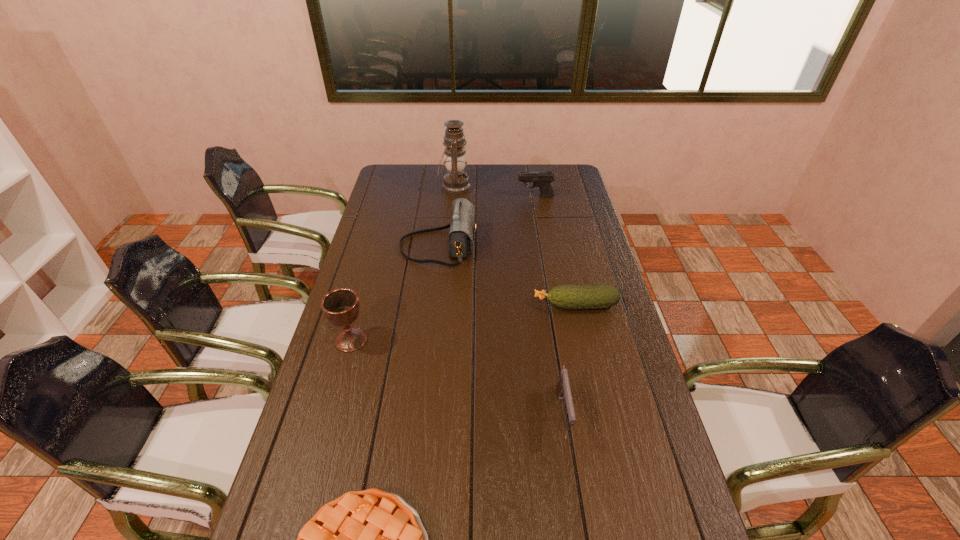
Where is `vacant space situated at the barrel of the farther pistol`? The height and width of the screenshot is (540, 960). vacant space situated at the barrel of the farther pistol is located at coordinates (479, 197).

In order to click on free spot located at the barrel of the farther pistol in this screenshot , I will do `click(477, 197)`.

Locate an element on the screen. The width and height of the screenshot is (960, 540). vacant space situated at the barrel of the farther pistol is located at coordinates (486, 197).

Where is `vacant point located 0.090m at the barrel of the nearer pistol`? Image resolution: width=960 pixels, height=540 pixels. vacant point located 0.090m at the barrel of the nearer pistol is located at coordinates (573, 478).

Where is `free space located at the blossom end of the cucumber`? Image resolution: width=960 pixels, height=540 pixels. free space located at the blossom end of the cucumber is located at coordinates (459, 305).

Locate an element on the screen. The height and width of the screenshot is (540, 960). free space located 0.230m at the blossom end of the cucumber is located at coordinates (466, 305).

I want to click on vacant point located at the blossom end of the cucumber, so click(447, 305).

Find the location of a particular element. object that is at the far edge is located at coordinates (456, 181).

The height and width of the screenshot is (540, 960). In order to click on shoulder bag that is at the left edge in this screenshot , I will do `click(462, 229)`.

Find the location of `chalice that is at the left edge`. chalice that is at the left edge is located at coordinates (340, 306).